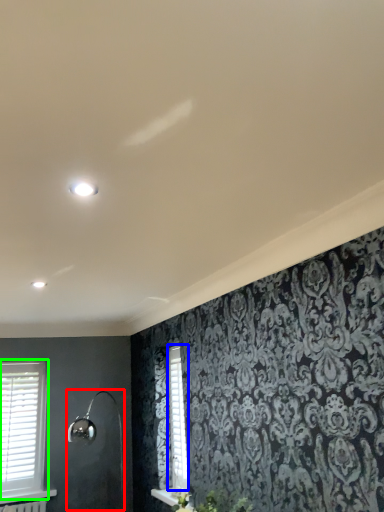
Question: Which object is positioned farthest from shower (highlighted by a red box)? Select from shutter (highlighted by a blue box) and window (highlighted by a green box).

Choices:
 (A) shutter
 (B) window

Answer: (A)